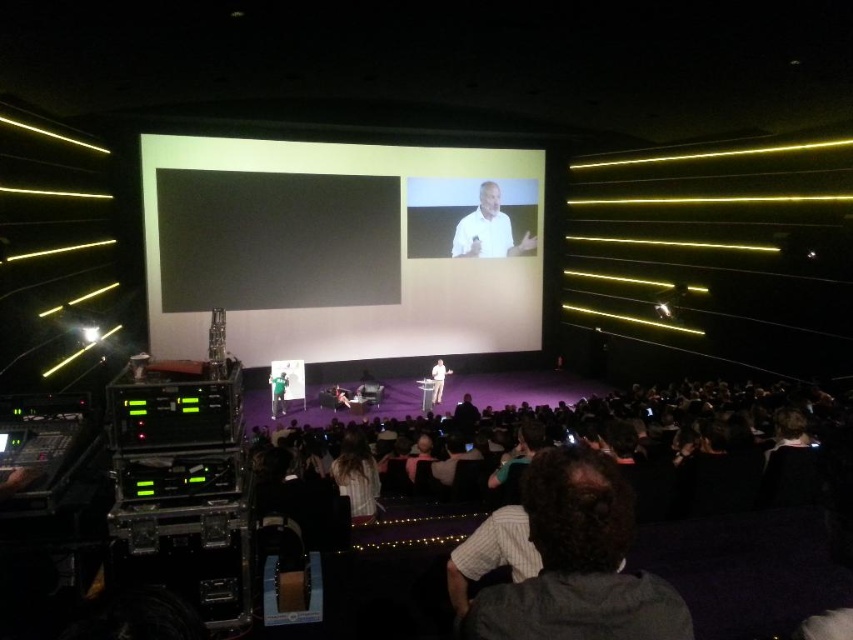
You are sitting in the audience of the presentation and want to take a photo of both the white matte projection screen at center and the dark brown hair at center. Which object should you zoom in on to capture both in the same frame?

The white matte projection screen at center is wider than the dark brown hair at center, so you should zoom in on the white matte projection screen at center to ensure both fit within the frame.

You are an attendee sitting in the front row of the conference hall and want to take a photo of the presentation. The white matte projection screen at center and the dark brown hair at center are both in your camera frame. Which object will appear larger in your photo?

The white matte projection screen at center will appear larger in your photo because it has a greater height compared to the dark brown hair at center.